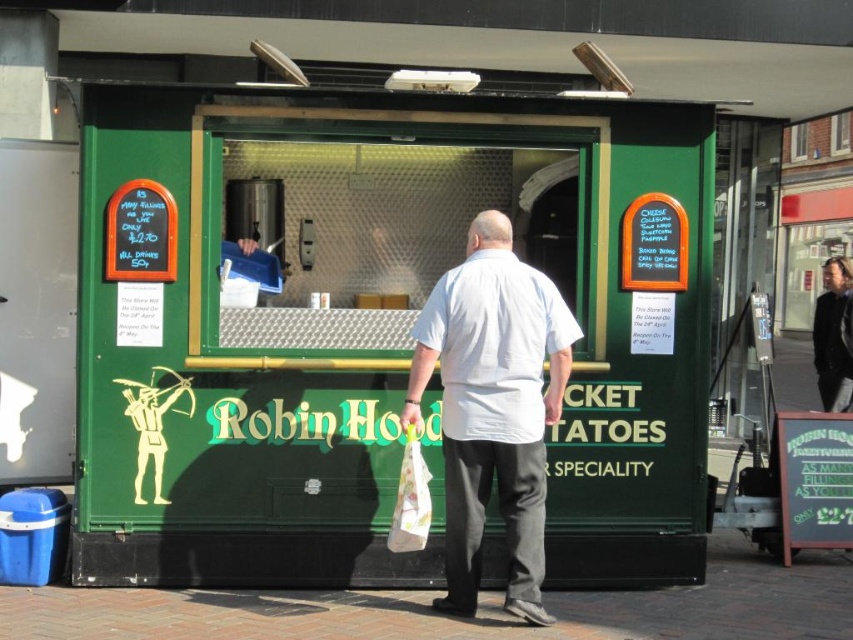
Is green matte food truck at center to the left of black leather jacket at upper right from the viewer's perspective?

Correct, you'll find green matte food truck at center to the left of black leather jacket at upper right.

Who is shorter, green matte food truck at center or black leather jacket at upper right?

black leather jacket at upper right is shorter.

Based on the photo, measure the distance between green matte food truck at center and camera.

green matte food truck at center and camera are 21.49 feet apart.

I want to click on green matte food truck at center, so click(376, 330).

Is white cotton shirt at center below white fabric bag at lower center?

Incorrect, white cotton shirt at center is not positioned below white fabric bag at lower center.

Which is in front, point (456, 284) or point (425, 540)?

Point (425, 540) is more forward.

Where is `white cotton shirt at center`? The width and height of the screenshot is (853, 640). white cotton shirt at center is located at coordinates (492, 406).

Where is `white cotton shirt at center`? Image resolution: width=853 pixels, height=640 pixels. white cotton shirt at center is located at coordinates (492, 406).

Locate an element on the screen. This screenshot has width=853, height=640. black leather jacket at upper right is located at coordinates (833, 336).

Is point (825, 381) less distant than point (408, 428)?

No, (825, 381) is further to viewer.

This screenshot has height=640, width=853. Find the location of `black leather jacket at upper right`. black leather jacket at upper right is located at coordinates (833, 336).